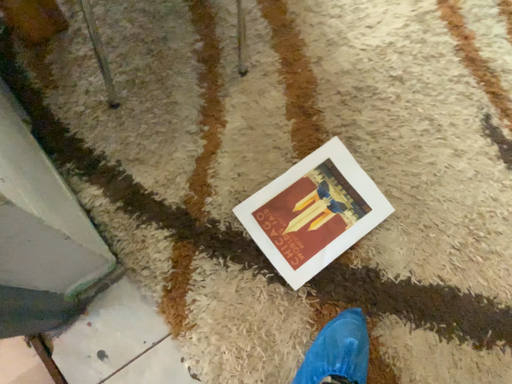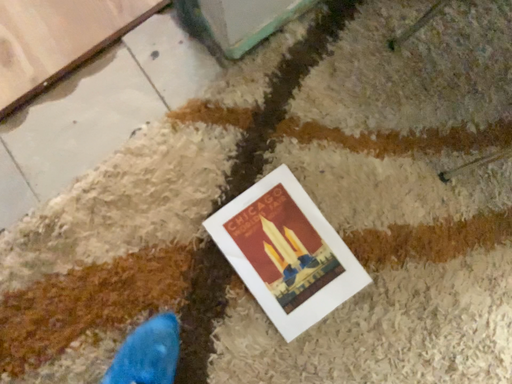
Question: How did the camera likely rotate when shooting the video?

Choices:
 (A) rotated downward
 (B) rotated upward

Answer: (B)